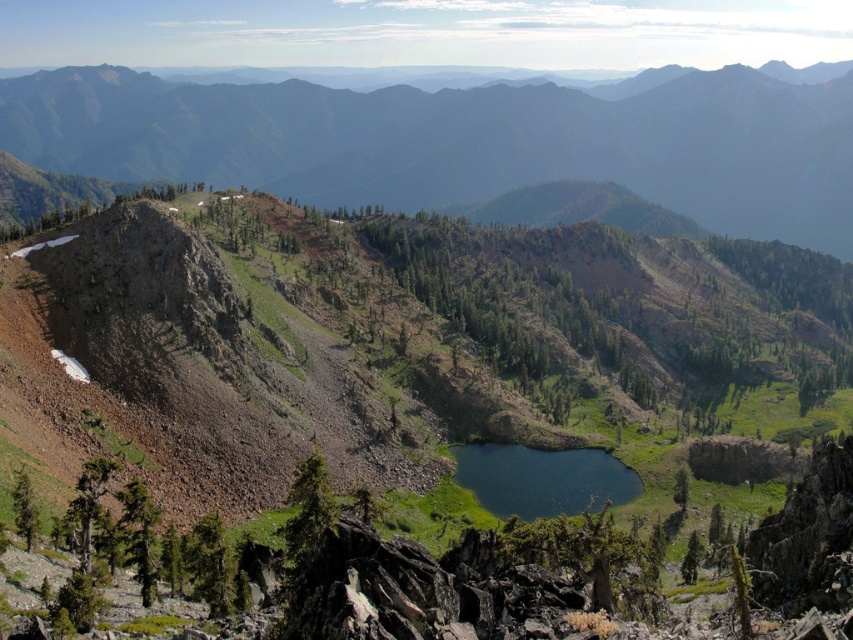
You are a hiker planning to cross the rugged terrain from the starting point at point [720,118] to the endpoint at point [503,451]. Based on the scene description, which direction should you move to reach the endpoint?

To reach the endpoint at point [503,451] from the starting point at point [720,118], you should move towards the lower right direction since point [503,451] is in front of point [720,118].

You are a hiker planning to cross from the rocky terrain in the foreground to the small dark blue alpine lake below. Which direction should you head relative to the green grassy mountain at upper center to reach the lake?

To reach the small dark blue alpine lake below, you should head downward from the green grassy mountain at upper center, as the lake is located in the valley below its position.

You are a hiker planning to cross the deep blue water at center and reach the green grassy mountain at upper center. Based on their widths, which path would you choose to ensure stability?

The green grassy mountain at upper center might be wider than the deep blue water at center, so choosing the path over the mountain would provide a more stable crossing due to its potentially broader base.